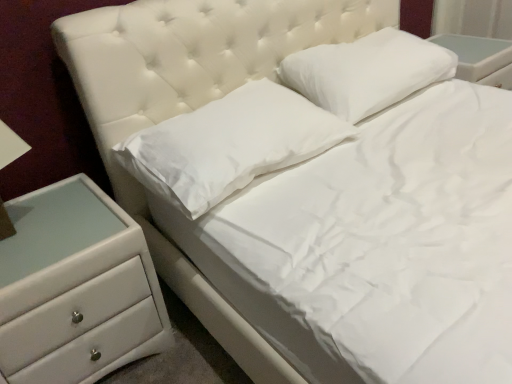
Question: Considering the relative positions of white soft pillow at upper center, which appears as the 2th pillow when viewed from the left, and white glossy chest of drawers at lower left in the image provided, is white soft pillow at upper center, which appears as the 2th pillow when viewed from the left, to the left or to the right of white glossy chest of drawers at lower left?

Choices:
 (A) left
 (B) right

Answer: (B)

Question: Is white soft pillow at upper center, which is counted as the 1th pillow, starting from the right, wider or thinner than white glossy chest of drawers at lower left?

Choices:
 (A) thin
 (B) wide

Answer: (A)

Question: Based on their relative distances, which object is nearer to the white soft pillow at center, which ranks as the first pillow in left-to-right order?

Choices:
 (A) white soft pillow at upper center, which is counted as the 1th pillow, starting from the right
 (B) white glossy chest of drawers at lower left

Answer: (B)

Question: Estimate the real-world distances between objects in this image. Which object is closer to the white glossy chest of drawers at lower left?

Choices:
 (A) white soft pillow at upper center, which is counted as the 1th pillow, starting from the right
 (B) white soft pillow at center, which is the 2th pillow in right-to-left order

Answer: (B)